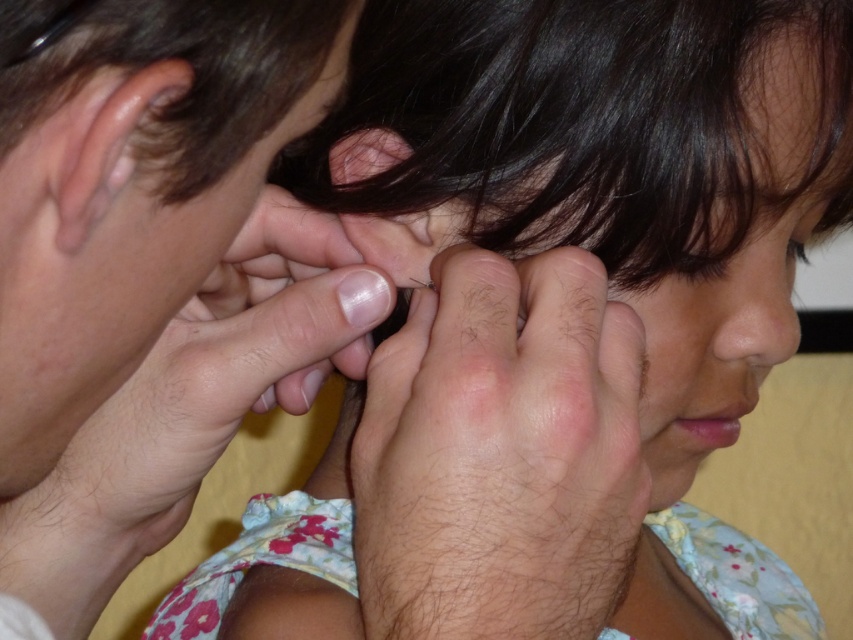
Based on the scene description, which object is positioned to the left of the other? Please identify the relationship between the smooth skin face at upper left and the hair at center.

The smooth skin face at upper left is positioned to the left of the hair at center.

You are a medical student observing a procedure. The smooth skin face at upper left and hair at center are part of the scene. How far apart are these two features?

The smooth skin face at upper left and hair at center are 4.31 inches apart.